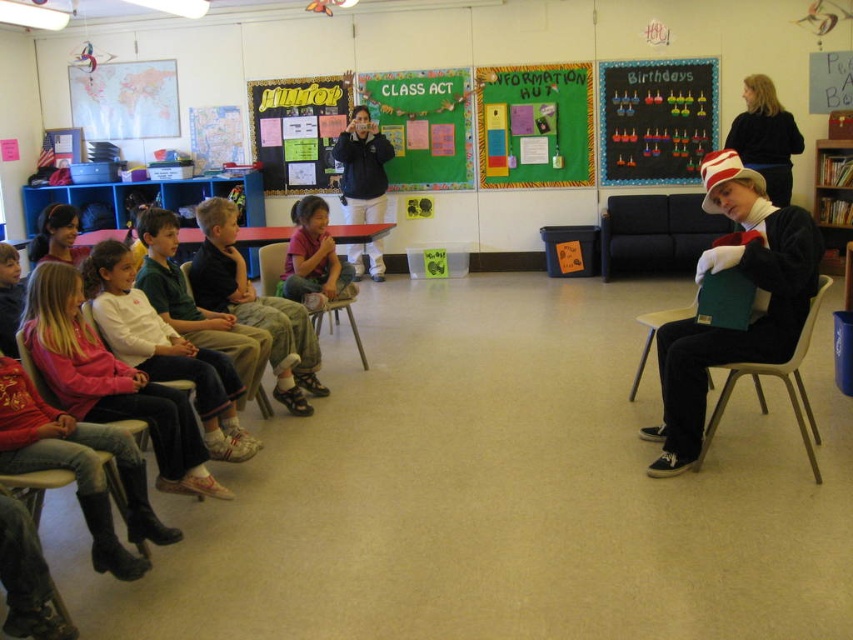
Can you confirm if white plush hat at right is positioned to the right of matte black jacket at center?

Indeed, white plush hat at right is positioned on the right side of matte black jacket at center.

Is white plush hat at right positioned at the back of matte black jacket at center?

No, white plush hat at right is closer to the viewer.

Where is `white plush hat at right`? Image resolution: width=853 pixels, height=640 pixels. white plush hat at right is located at coordinates (654, 234).

Locate an element on the screen. white plush hat at right is located at coordinates (654, 234).

Between blackboard with colorful markers at upper right and black sweater at upper right, which one is positioned lower?

black sweater at upper right

Which is behind, point (608, 92) or point (788, 118)?

The point (608, 92) is more distant.

Which is in front, point (653, 83) or point (785, 118)?

Point (785, 118)

This screenshot has height=640, width=853. I want to click on blackboard with colorful markers at upper right, so click(656, 120).

What do you see at coordinates (314, 259) in the screenshot?
I see `pink fabric shirt at center` at bounding box center [314, 259].

Which is above, pink fabric shirt at center or wooden chair at center?

pink fabric shirt at center is above.

Between point (328, 259) and point (329, 308), which one is positioned behind?

Positioned behind is point (328, 259).

Image resolution: width=853 pixels, height=640 pixels. Find the location of `pink fabric shirt at center`. pink fabric shirt at center is located at coordinates (314, 259).